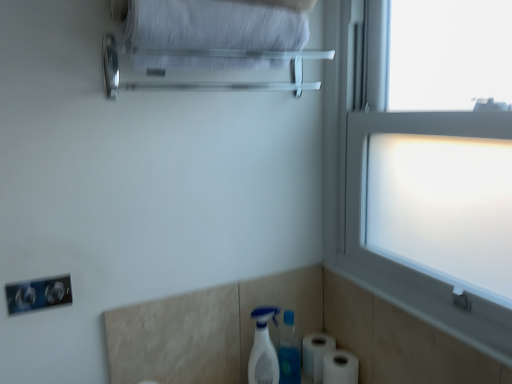
Question: Can you confirm if white plastic spray bottle at lower center is positioned to the right of frosted glass window at right?

Choices:
 (A) yes
 (B) no

Answer: (B)

Question: From the image's perspective, is white plastic spray bottle at lower center under frosted glass window at right?

Choices:
 (A) no
 (B) yes

Answer: (B)

Question: Is white plastic spray bottle at lower center wider than frosted glass window at right?

Choices:
 (A) yes
 (B) no

Answer: (B)

Question: Could you tell me if white plastic spray bottle at lower center is turned towards frosted glass window at right?

Choices:
 (A) no
 (B) yes

Answer: (A)

Question: Is there a large distance between white plastic spray bottle at lower center and frosted glass window at right?

Choices:
 (A) no
 (B) yes

Answer: (A)

Question: From a real-world perspective, is white plastic spray bottle at lower center on frosted glass window at right?

Choices:
 (A) yes
 (B) no

Answer: (B)

Question: Is white fabric bath towel at upper center oriented towards frosted glass window at right?

Choices:
 (A) yes
 (B) no

Answer: (B)

Question: Is white fabric bath towel at upper center thinner than frosted glass window at right?

Choices:
 (A) no
 (B) yes

Answer: (A)

Question: From the image's perspective, is white fabric bath towel at upper center below frosted glass window at right?

Choices:
 (A) yes
 (B) no

Answer: (B)

Question: From a real-world perspective, is white fabric bath towel at upper center physically below frosted glass window at right?

Choices:
 (A) yes
 (B) no

Answer: (B)

Question: Is white fabric bath towel at upper center bigger than frosted glass window at right?

Choices:
 (A) no
 (B) yes

Answer: (A)

Question: Is white fabric bath towel at upper center positioned behind frosted glass window at right?

Choices:
 (A) no
 (B) yes

Answer: (B)

Question: From the image's perspective, is frosted glass window at right above white matte toilet paper at lower right, the first toilet paper when ordered from front to back?

Choices:
 (A) yes
 (B) no

Answer: (A)